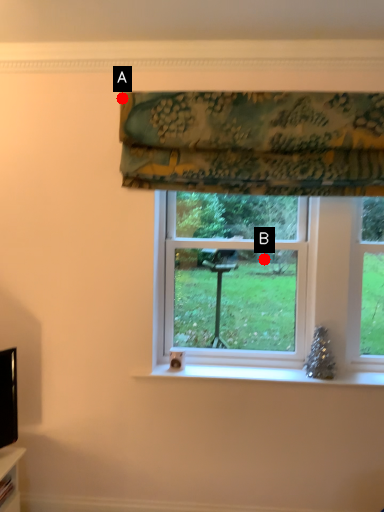
Question: Two points are circled on the image, labeled by A and B beside each circle. Which point appears closest to the camera in this image?

Choices:
 (A) A is closer
 (B) B is closer

Answer: (A)